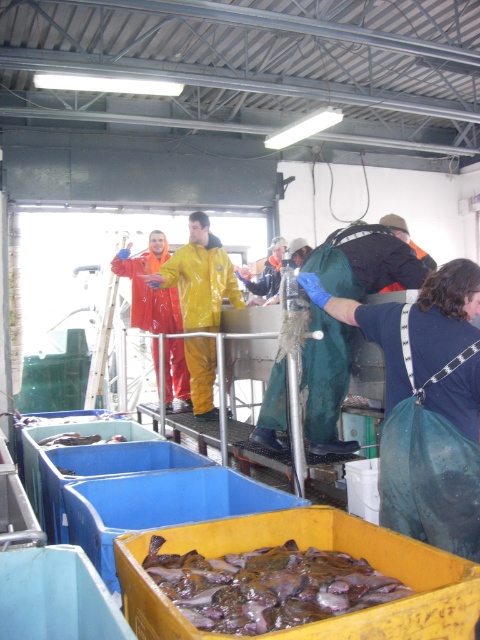
Question: Does yellow waterproof suit at center appear on the right side of orange waterproof suit at center?

Choices:
 (A) yes
 (B) no

Answer: (A)

Question: Is purple rubber fish at lower center below yellow waterproof suit at center?

Choices:
 (A) yes
 (B) no

Answer: (A)

Question: Can you confirm if yellow waterproof suit at center is smaller than orange waterproof suit at center?

Choices:
 (A) no
 (B) yes

Answer: (B)

Question: Which object is closer to the camera taking this photo?

Choices:
 (A) green waterproof suit at center
 (B) purple rubber fish at lower center
 (C) orange waterproof suit at center
 (D) yellow waterproof suit at center

Answer: (B)

Question: Which of the following is the closest to the observer?

Choices:
 (A) yellow waterproof suit at center
 (B) purple rubber fish at lower center
 (C) orange waterproof suit at center
 (D) green waterproof suit at center

Answer: (B)

Question: Which object is farther from the camera taking this photo?

Choices:
 (A) purple rubber fish at lower center
 (B) orange waterproof suit at center
 (C) yellow waterproof suit at center
 (D) green waterproof suit at center

Answer: (B)